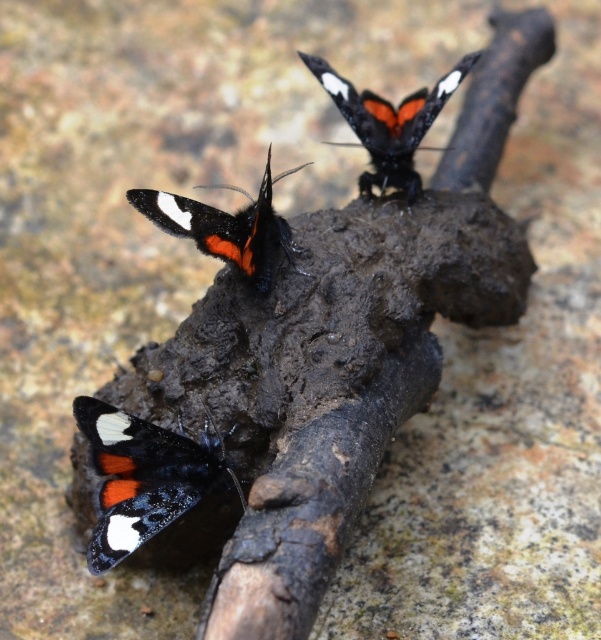
Describe the element at coordinates (227, 227) in the screenshot. The height and width of the screenshot is (640, 601). I see `black glossy butterfly at center` at that location.

Can you confirm if black glossy butterfly at center is positioned above matte black butterfly at upper center?

Incorrect, black glossy butterfly at center is not positioned above matte black butterfly at upper center.

Is point (182, 236) more distant than point (415, 138)?

No, (182, 236) is closer to viewer.

This screenshot has height=640, width=601. I want to click on black glossy butterfly at center, so click(x=227, y=227).

Is matte black butterfly at lower left further to the viewer compared to black glossy butterfly at center?

No.

Between matte black butterfly at lower left and black glossy butterfly at center, which one has less height?

With less height is black glossy butterfly at center.

Is point (156, 472) closer to viewer compared to point (249, 276)?

Yes, point (156, 472) is closer to viewer.

Where is `matte black butterfly at lower left`? matte black butterfly at lower left is located at coordinates (144, 476).

Can you confirm if matte black butterfly at lower left is shorter than matte black butterfly at upper center?

Result: Yes, matte black butterfly at lower left is shorter than matte black butterfly at upper center.

Image resolution: width=601 pixels, height=640 pixels. Describe the element at coordinates (144, 476) in the screenshot. I see `matte black butterfly at lower left` at that location.

The width and height of the screenshot is (601, 640). I want to click on matte black butterfly at lower left, so click(144, 476).